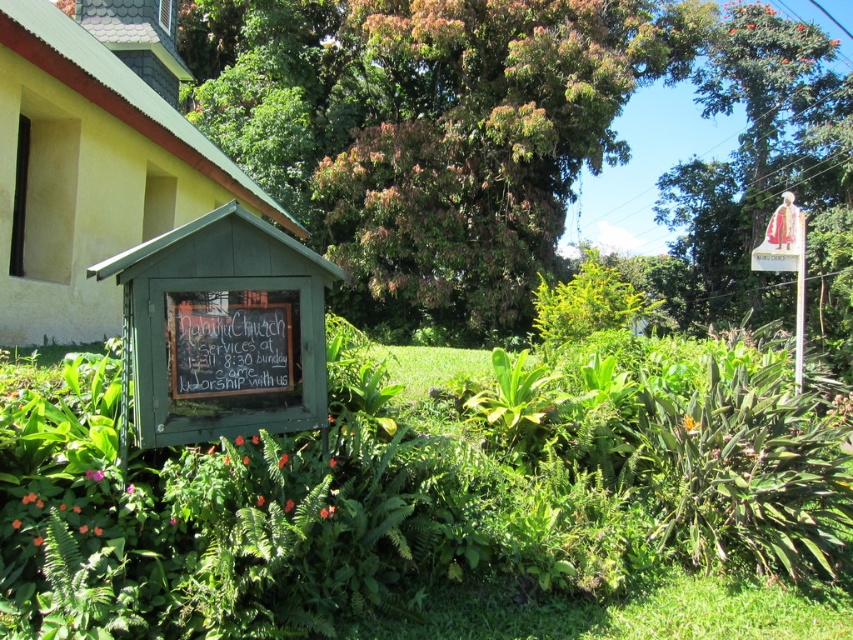
Is green wood signboard at lower left closer to camera compared to black chalkboard at center?

No, it is not.

Is point (109, 189) positioned before point (200, 378)?

No, (109, 189) is behind (200, 378).

Identify the location of green wood signboard at lower left. The width and height of the screenshot is (853, 640). (88, 173).

Can you confirm if green leafy tree at upper center is positioned above wooden sign at upper right?

Yes.

Is green leafy tree at upper center in front of wooden sign at upper right?

No, it is not.

At what (x,y) coordinates should I click in order to perform the action: click on green leafy tree at upper center. Please return your answer as a coordinate pair (x, y). This screenshot has width=853, height=640. Looking at the image, I should click on (755, 157).

Identify the location of green leafy tree at upper center. (755, 157).

Which of these two, green matte signboard at lower left or green leafy tree at upper center, stands shorter?

green matte signboard at lower left is shorter.

Does green matte signboard at lower left appear over green leafy tree at upper center?

Incorrect, green matte signboard at lower left is not positioned above green leafy tree at upper center.

Who is more distant from viewer, (155, 298) or (752, 168)?

The point (752, 168) is more distant.

Identify the location of green matte signboard at lower left. (221, 330).